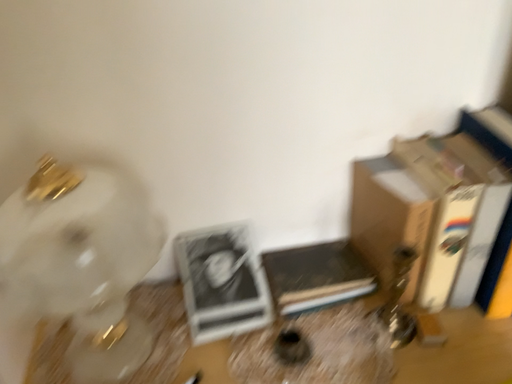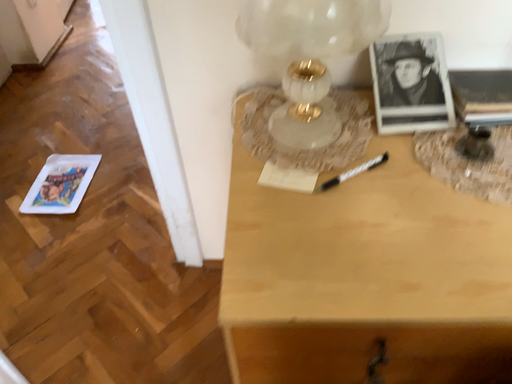
Question: Which way did the camera rotate in the video?

Choices:
 (A) rotated upward
 (B) rotated downward

Answer: (B)